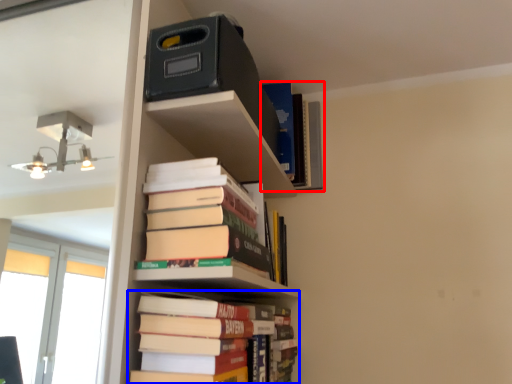
Question: Among these objects, which one is farthest to the camera, book (highlighted by a red box) or book (highlighted by a blue box)?

Choices:
 (A) book
 (B) book

Answer: (A)